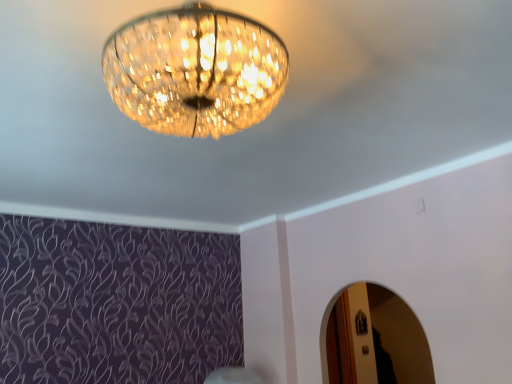
Question: Based on their sizes in the image, would you say crystal glass chandelier at upper center is bigger or smaller than metallic silver mirror at lower right?

Choices:
 (A) small
 (B) big

Answer: (B)

Question: Is crystal glass chandelier at upper center in front of or behind metallic silver mirror at lower right in the image?

Choices:
 (A) front
 (B) behind

Answer: (A)

Question: Do you think crystal glass chandelier at upper center is within metallic silver mirror at lower right, or outside of it?

Choices:
 (A) inside
 (B) outside

Answer: (B)

Question: From their relative heights in the image, would you say metallic silver mirror at lower right is taller or shorter than crystal glass chandelier at upper center?

Choices:
 (A) short
 (B) tall

Answer: (B)

Question: Considering the relative positions of metallic silver mirror at lower right and crystal glass chandelier at upper center in the image provided, is metallic silver mirror at lower right to the left or to the right of crystal glass chandelier at upper center?

Choices:
 (A) left
 (B) right

Answer: (B)

Question: From the image's perspective, is metallic silver mirror at lower right located above or below crystal glass chandelier at upper center?

Choices:
 (A) below
 (B) above

Answer: (A)

Question: Is metallic silver mirror at lower right inside the boundaries of crystal glass chandelier at upper center, or outside?

Choices:
 (A) outside
 (B) inside

Answer: (A)